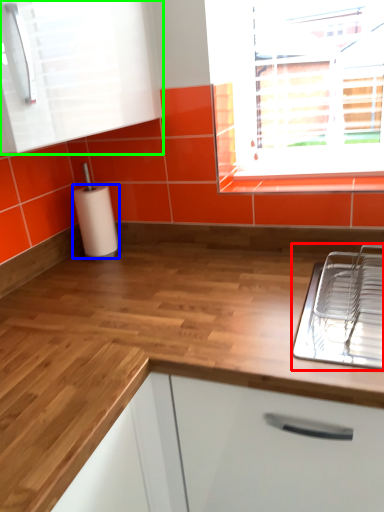
Question: Which is farther away from appliance (highlighted by a red box)? paper towel (highlighted by a blue box) or cabinetry (highlighted by a green box)?

Choices:
 (A) paper towel
 (B) cabinetry

Answer: (A)